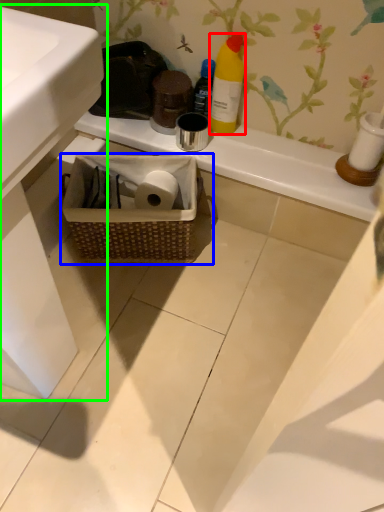
Question: Considering the real-world distances, which object is farthest from bottle (highlighted by a red box)? picnic basket (highlighted by a blue box) or sink (highlighted by a green box)?

Choices:
 (A) picnic basket
 (B) sink

Answer: (B)